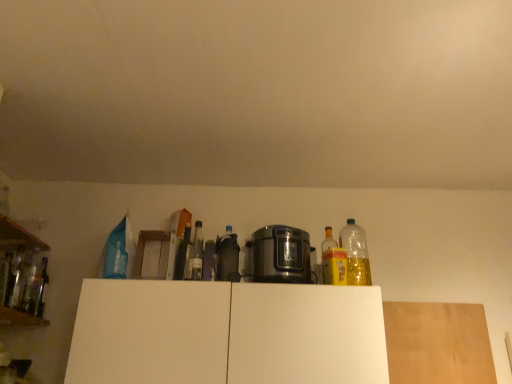
Question: From the image's perspective, is clear glass bottle at center, which ranks as the fourth bottle in right-to-left order, on top of clear glass bottle at left, the 7th bottle in the right-to-left sequence?

Choices:
 (A) yes
 (B) no

Answer: (A)

Question: Considering the relative positions of clear glass bottle at center, acting as the fifth bottle starting from the left, and clear glass bottle at left, the second bottle from the left, in the image provided, is clear glass bottle at center, acting as the fifth bottle starting from the left, to the right of clear glass bottle at left, the second bottle from the left, from the viewer's perspective?

Choices:
 (A) no
 (B) yes

Answer: (B)

Question: Is clear glass bottle at center, which ranks as the fourth bottle in right-to-left order, positioned far away from clear glass bottle at left, the second bottle from the left?

Choices:
 (A) yes
 (B) no

Answer: (B)

Question: Can you confirm if clear glass bottle at center, which ranks as the fourth bottle in right-to-left order, is wider than clear glass bottle at left, the 7th bottle in the right-to-left sequence?

Choices:
 (A) no
 (B) yes

Answer: (A)

Question: Does clear glass bottle at center, which ranks as the fourth bottle in right-to-left order, contain clear glass bottle at left, the 7th bottle in the right-to-left sequence?

Choices:
 (A) yes
 (B) no

Answer: (B)

Question: From the image's perspective, does clear glass bottle at center, which ranks as the fourth bottle in right-to-left order, appear lower than clear glass bottle at left, the 7th bottle in the right-to-left sequence?

Choices:
 (A) no
 (B) yes

Answer: (A)

Question: Is clear glass bottles at left, which appears as the third bottle when viewed from the left, inside clear glass bottle at left, which appears as the 1th bottle when viewed from the left?

Choices:
 (A) yes
 (B) no

Answer: (B)

Question: Is clear glass bottle at left, positioned as the eighth bottle in right-to-left order, placed right next to clear glass bottles at left, the sixth bottle when ordered from right to left?

Choices:
 (A) no
 (B) yes

Answer: (A)

Question: From the image's perspective, is clear glass bottle at left, which appears as the 1th bottle when viewed from the left, below clear glass bottles at left, which appears as the third bottle when viewed from the left?

Choices:
 (A) no
 (B) yes

Answer: (A)

Question: Is clear glass bottle at left, positioned as the eighth bottle in right-to-left order, turned away from clear glass bottles at left, the sixth bottle when ordered from right to left?

Choices:
 (A) yes
 (B) no

Answer: (B)

Question: Does clear glass bottle at left, which appears as the 1th bottle when viewed from the left, have a smaller size compared to clear glass bottles at left, the sixth bottle when ordered from right to left?

Choices:
 (A) yes
 (B) no

Answer: (B)

Question: From the image's perspective, does clear glass bottle at left, positioned as the eighth bottle in right-to-left order, appear higher than clear glass bottles at left, the sixth bottle when ordered from right to left?

Choices:
 (A) yes
 (B) no

Answer: (A)

Question: Is white matte cabinet at center to the left of wooden at left, which is counted as the second shelf, starting from the bottom, from the viewer's perspective?

Choices:
 (A) no
 (B) yes

Answer: (A)